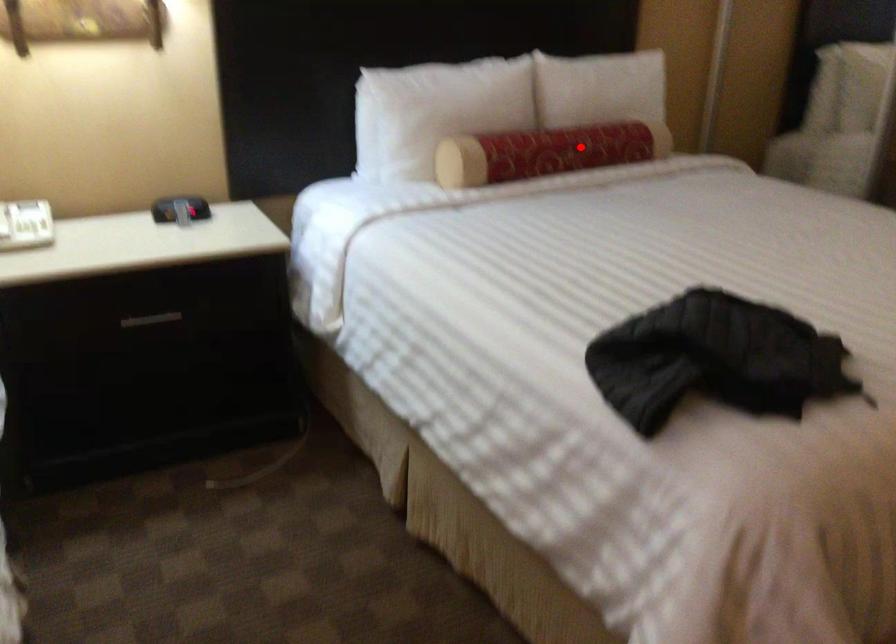
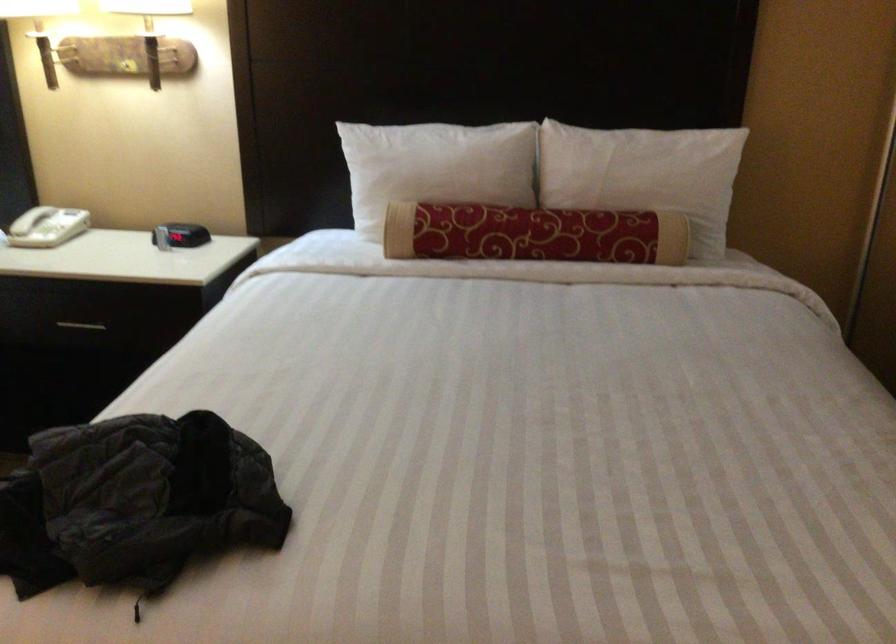
Question: I am providing you with two images of the same scene from different viewpoints. Given a red point in image1, look at the same physical point in image2. Is it:

Choices:
 (A) Closer to the viewpoint
 (B) Farther from the viewpoint

Answer: (A)